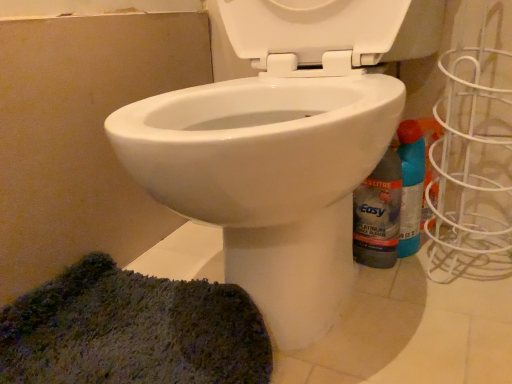
Question: Is blue plastic spray bottle at right wider than green textured rug at lower left?

Choices:
 (A) no
 (B) yes

Answer: (A)

Question: Considering the relative sizes of blue plastic spray bottle at right and green textured rug at lower left in the image provided, is blue plastic spray bottle at right smaller than green textured rug at lower left?

Choices:
 (A) no
 (B) yes

Answer: (B)

Question: Considering the relative positions of blue plastic spray bottle at right and green textured rug at lower left in the image provided, is blue plastic spray bottle at right behind green textured rug at lower left?

Choices:
 (A) yes
 (B) no

Answer: (A)

Question: Does blue plastic spray bottle at right have a greater height compared to green textured rug at lower left?

Choices:
 (A) yes
 (B) no

Answer: (A)

Question: Can you confirm if blue plastic spray bottle at right is thinner than green textured rug at lower left?

Choices:
 (A) yes
 (B) no

Answer: (A)

Question: Is blue plastic spray bottle at right bigger than green textured rug at lower left?

Choices:
 (A) no
 (B) yes

Answer: (A)

Question: From the image's perspective, does blue plastic spray bottle at right appear lower than translucent plastic bottle at lower right?

Choices:
 (A) no
 (B) yes

Answer: (A)

Question: Is blue plastic spray bottle at right positioned far away from translucent plastic bottle at lower right?

Choices:
 (A) no
 (B) yes

Answer: (A)

Question: Could you tell me if blue plastic spray bottle at right is facing translucent plastic bottle at lower right?

Choices:
 (A) no
 (B) yes

Answer: (B)

Question: Does blue plastic spray bottle at right have a lesser width compared to translucent plastic bottle at lower right?

Choices:
 (A) no
 (B) yes

Answer: (A)

Question: Does blue plastic spray bottle at right lie behind translucent plastic bottle at lower right?

Choices:
 (A) no
 (B) yes

Answer: (B)

Question: Is blue plastic spray bottle at right located outside translucent plastic bottle at lower right?

Choices:
 (A) no
 (B) yes

Answer: (B)

Question: Is translucent plastic bottle at lower right taller than blue plastic spray bottle at right?

Choices:
 (A) yes
 (B) no

Answer: (A)